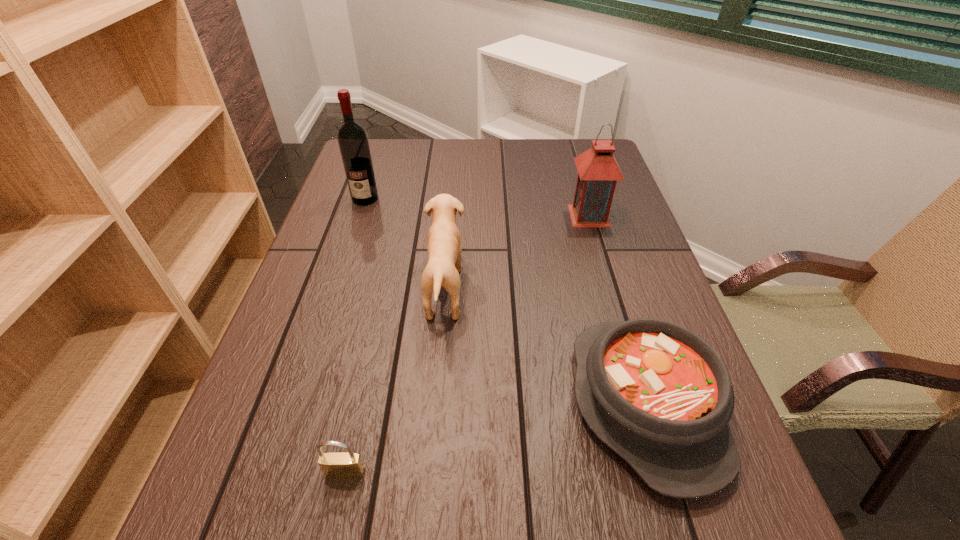
Where is `free space between the casserole and the second tallest object`? The width and height of the screenshot is (960, 540). free space between the casserole and the second tallest object is located at coordinates (617, 310).

What are the coordinates of `free space between the leftmost object and the second tallest object` in the screenshot? It's located at (477, 207).

At what (x,y) coordinates should I click in order to perform the action: click on vacant region between the second object from left to right and the casserole. Please return your answer as a coordinate pair (x, y). This screenshot has width=960, height=540. Looking at the image, I should click on (495, 438).

The image size is (960, 540). Identify the location of vacant area between the fourth shortest object and the casserole. (x=617, y=310).

This screenshot has height=540, width=960. I want to click on free point between the puppy and the padlock, so click(x=396, y=381).

I want to click on empty location between the third object from right to left and the alcohol, so click(405, 244).

Where is `blank region between the third shortest object and the padlock`? This screenshot has width=960, height=540. blank region between the third shortest object and the padlock is located at coordinates (396, 381).

Where is `empty location between the fourth shortest object and the leftmost object`? The height and width of the screenshot is (540, 960). empty location between the fourth shortest object and the leftmost object is located at coordinates (477, 207).

This screenshot has width=960, height=540. Identify the location of vacant space that is in between the lantern and the alcohol. (477, 207).

You are a GUI agent. You are given a task and a screenshot of the screen. Output one action in this format:
    pyautogui.click(x=<x>, y=<y>)
    Task: Click on the object identified as the third closest to the padlock
    
    Given the screenshot: What is the action you would take?
    pyautogui.click(x=352, y=138)